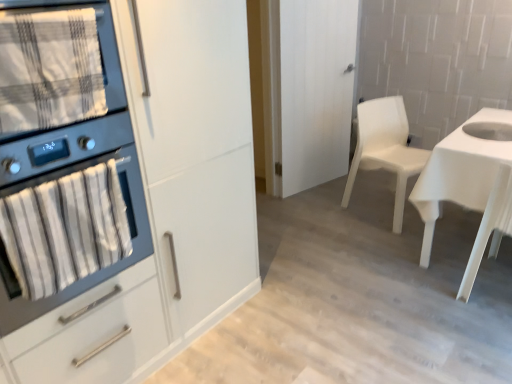
Question: Is matte black oven at left not close to white glossy desk at right?

Choices:
 (A) yes
 (B) no

Answer: (A)

Question: Does matte black oven at left come behind white glossy desk at right?

Choices:
 (A) no
 (B) yes

Answer: (A)

Question: Is matte black oven at left directly adjacent to white glossy desk at right?

Choices:
 (A) no
 (B) yes

Answer: (A)

Question: Considering the relative sizes of matte black oven at left and white glossy desk at right in the image provided, is matte black oven at left smaller than white glossy desk at right?

Choices:
 (A) no
 (B) yes

Answer: (A)

Question: Does matte black oven at left appear on the right side of white glossy desk at right?

Choices:
 (A) yes
 (B) no

Answer: (B)

Question: Does matte black oven at left lie in front of white glossy desk at right?

Choices:
 (A) no
 (B) yes

Answer: (B)

Question: Is white matte cabinet at left at the right side of white matte door at center?

Choices:
 (A) no
 (B) yes

Answer: (A)

Question: Is white matte cabinet at left smaller than white matte door at center?

Choices:
 (A) no
 (B) yes

Answer: (A)

Question: Considering the relative sizes of white matte cabinet at left and white matte door at center in the image provided, is white matte cabinet at left wider than white matte door at center?

Choices:
 (A) no
 (B) yes

Answer: (B)

Question: From the image's perspective, is white matte cabinet at left above white matte door at center?

Choices:
 (A) no
 (B) yes

Answer: (A)

Question: From the image's perspective, is white matte cabinet at left under white matte door at center?

Choices:
 (A) yes
 (B) no

Answer: (A)

Question: Can you confirm if white matte cabinet at left is bigger than white matte door at center?

Choices:
 (A) yes
 (B) no

Answer: (A)

Question: Is matte black oven at left completely or partially inside white matte cabinet at left?

Choices:
 (A) no
 (B) yes

Answer: (B)